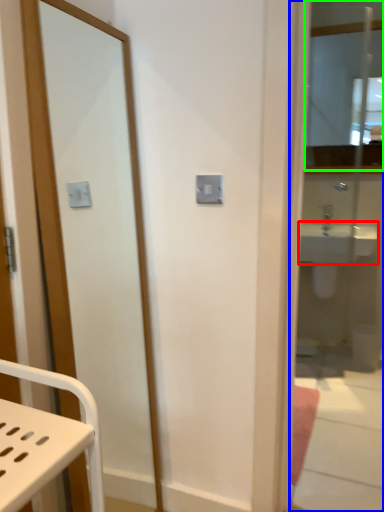
Question: Estimate the real-world distances between objects in this image. Which object is closer to sink (highlighted by a red box), mirror (highlighted by a blue box) or mirror (highlighted by a green box)?

Choices:
 (A) mirror
 (B) mirror

Answer: (A)